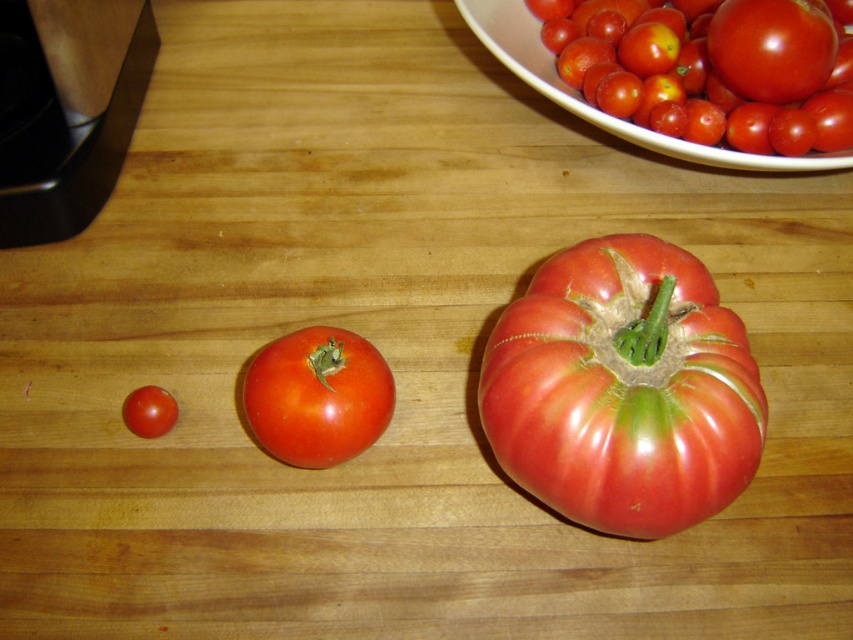
Describe the element at coordinates (622, 390) in the screenshot. The image size is (853, 640). I see `red matte tomato at center` at that location.

Is red matte tomato at center positioned at the back of glossy ceramic bowl at upper right?

No, it is in front of glossy ceramic bowl at upper right.

The image size is (853, 640). Identify the location of red matte tomato at center. (622, 390).

Does point (347, 353) lie behind point (764, 35)?

No, it is in front of (764, 35).

Which is above, shiny red tomato at center or glossy red tomato at upper right?

Positioned higher is glossy red tomato at upper right.

Identify the location of shiny red tomato at center. The height and width of the screenshot is (640, 853). click(x=317, y=396).

Where is `shiny red tomato at center`? This screenshot has height=640, width=853. shiny red tomato at center is located at coordinates coord(317,396).

Between red matte tomato at center and shiny red tomato at center, which one is positioned higher?

Positioned higher is red matte tomato at center.

Can you confirm if red matte tomato at center is bigger than shiny red tomato at center?

Indeed, red matte tomato at center has a larger size compared to shiny red tomato at center.

Which is in front, point (711, 323) or point (274, 384)?

Positioned in front is point (711, 323).

You are a GUI agent. You are given a task and a screenshot of the screen. Output one action in this format:
    pyautogui.click(x=<x>, y=<y>)
    Task: Click on the red matte tomato at center
    
    Given the screenshot: What is the action you would take?
    pyautogui.click(x=622, y=390)